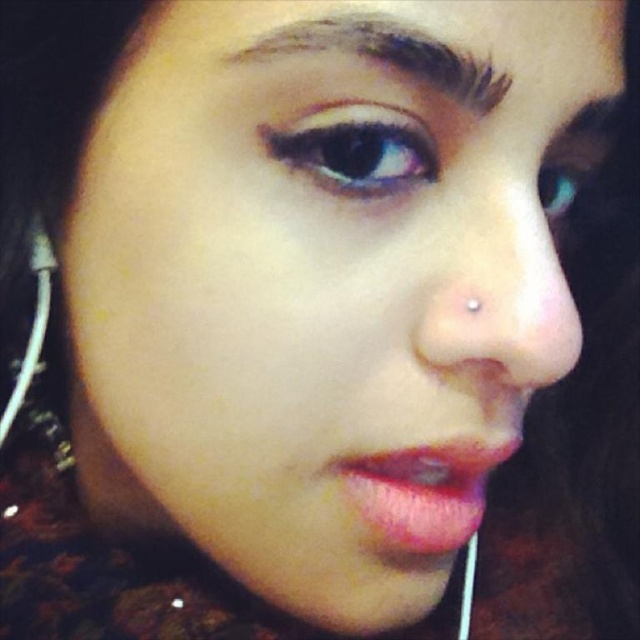
Question: Which object appears farthest from the camera in this image?

Choices:
 (A) blue glossy eye at upper right
 (B) black glossy eye at upper center

Answer: (A)

Question: Where is black glossy eye at upper center located in relation to dark brown hair at upper center in the image?

Choices:
 (A) below
 (B) above

Answer: (A)

Question: Which object is positioned closest to the dark brown hair at upper center?

Choices:
 (A) pink glossy lips at center
 (B) smooth flesh nose at center
 (C) black glossy eye at upper center
 (D) blue glossy eye at upper right

Answer: (C)

Question: Is dark brown hair at upper center wider than blue glossy eye at upper right?

Choices:
 (A) no
 (B) yes

Answer: (B)

Question: Is smooth flesh nose at center to the right of black glossy eye at upper center from the viewer's perspective?

Choices:
 (A) yes
 (B) no

Answer: (A)

Question: Estimate the real-world distances between objects in this image. Which object is closer to the black glossy eye at upper center?

Choices:
 (A) pink glossy lips at center
 (B) blue glossy eye at upper right
 (C) smooth flesh nose at center

Answer: (C)